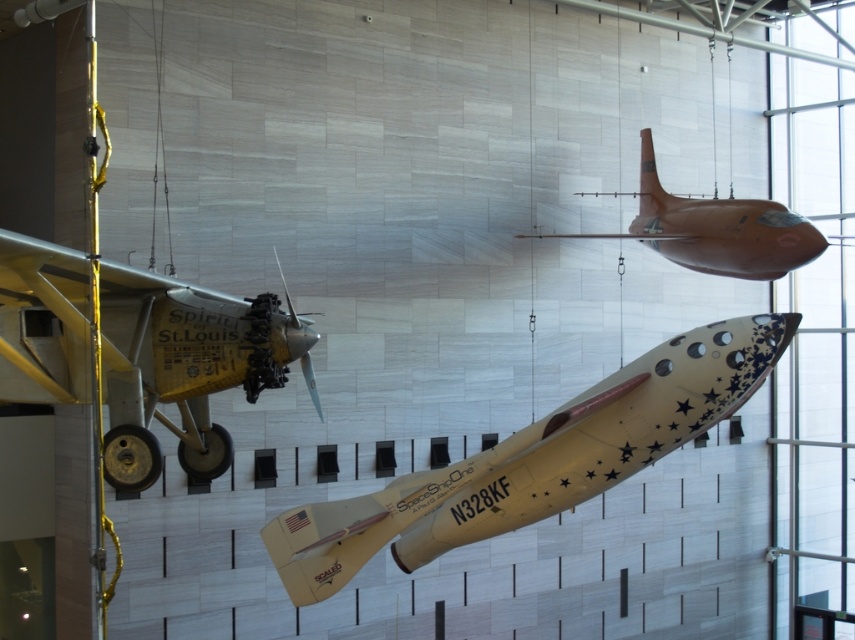
Between matte orange airplane at upper right and metallic silver propeller at center, which one has less height?

With less height is metallic silver propeller at center.

Is matte orange airplane at upper right to the right of metallic silver propeller at center from the viewer's perspective?

Yes, matte orange airplane at upper right is to the right of metallic silver propeller at center.

This screenshot has height=640, width=855. What do you see at coordinates (715, 228) in the screenshot?
I see `matte orange airplane at upper right` at bounding box center [715, 228].

You are a GUI agent. You are given a task and a screenshot of the screen. Output one action in this format:
    pyautogui.click(x=<x>, y=<y>)
    Task: Click on the matte orange airplane at upper right
    The image size is (855, 640).
    Given the screenshot: What is the action you would take?
    pyautogui.click(x=715, y=228)

Looking at this image, who is higher up, white glossy rocket at center or yellow matte airplane at left?

yellow matte airplane at left

Who is taller, white glossy rocket at center or yellow matte airplane at left?

Standing taller between the two is white glossy rocket at center.

Which is behind, point (370, 545) or point (252, 342)?

The point (370, 545) is behind.

Where is `white glossy rocket at center`? Image resolution: width=855 pixels, height=640 pixels. white glossy rocket at center is located at coordinates (535, 460).

Where is `yellow matte airplane at left`? This screenshot has width=855, height=640. yellow matte airplane at left is located at coordinates (186, 365).

Is yellow matte airplane at left taller than metallic silver propeller at center?

Yes, yellow matte airplane at left is taller than metallic silver propeller at center.

This screenshot has height=640, width=855. What do you see at coordinates (186, 365) in the screenshot? I see `yellow matte airplane at left` at bounding box center [186, 365].

Where is `yellow matte airplane at left`? yellow matte airplane at left is located at coordinates (186, 365).